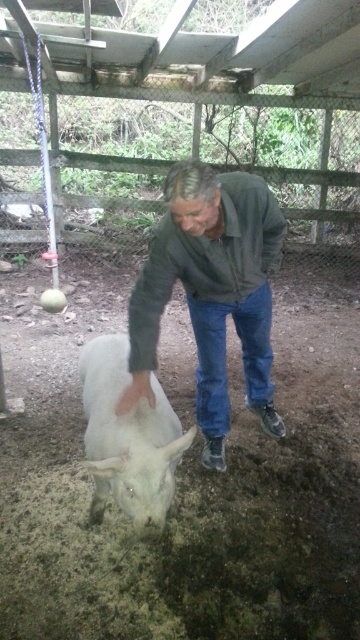
Based on the photo, you are a farmer who wants to check the health of the white woolly goat at lower left. However, you are currently standing near the green matte shirt at center. Can you reach the goat without moving the shirt?

The green matte shirt at center is positioned over the white woolly goat at lower left, so you cannot reach the goat without moving the shirt.

You are a photographer trying to capture a closeup of the green matte shirt at center and the white woolly goat at lower left. Since you want both subjects to appear equally sized in the photo, which subject should you move closer to the camera?

The white woolly goat at lower left should be moved closer to the camera because the green matte shirt at center is wider than the white woolly goat at lower left, so moving the smaller object closer can balance their sizes in the frame.

What are the coordinates of the green matte shirt at center?

The green matte shirt at center is located at coordinates point (210, 292).